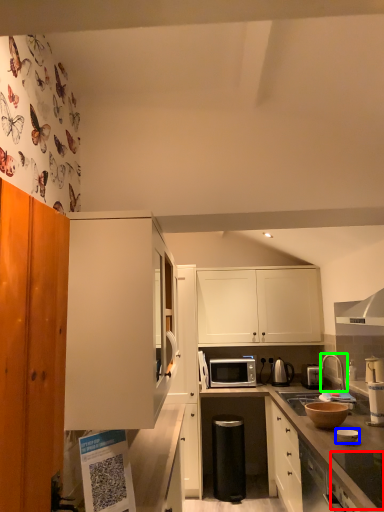
Question: Considering the real-world distances, which object is farthest from appliance (highlighted by a red box)? appliance (highlighted by a blue box) or tap (highlighted by a green box)?

Choices:
 (A) appliance
 (B) tap

Answer: (B)